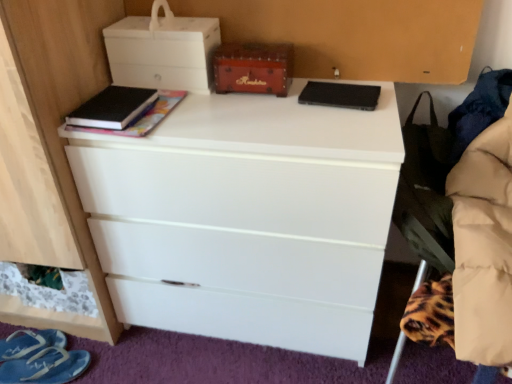
Identify the location of free space behind black matte speaker at upper center, placed as the first book when sorted from right to left. This screenshot has height=384, width=512. (337, 79).